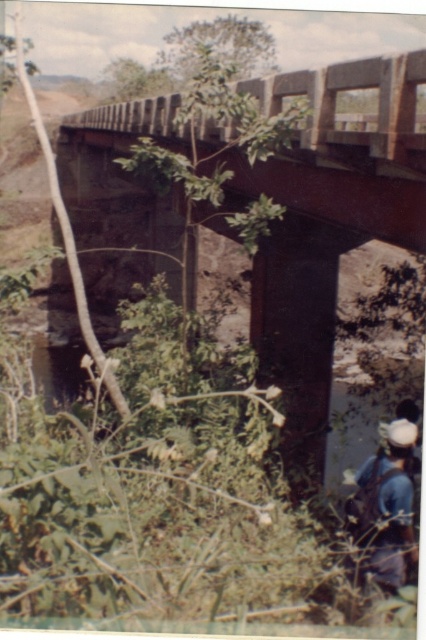
Between rusty metal bridge at upper center and blue denim jeans at lower right, which one has less height?

blue denim jeans at lower right is shorter.

Is point (334, 154) positioned after point (400, 445)?

Yes, point (334, 154) is farther from viewer.

Locate an element on the screen. rusty metal bridge at upper center is located at coordinates (319, 221).